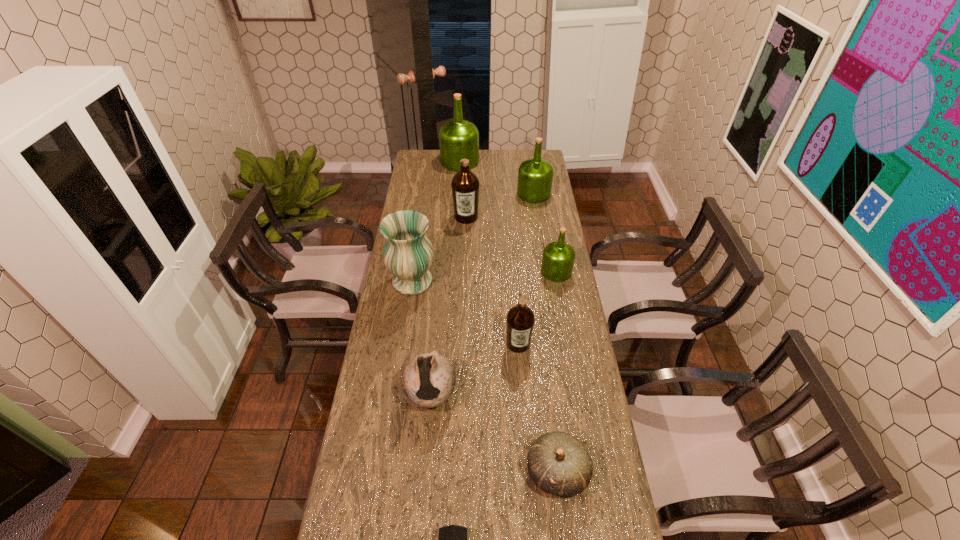
Identify the location of vacant space at the far left corner of the desktop. (423, 154).

Locate an element on the screen. free space that is in between the eighth tallest object and the fourth nearest olive oil is located at coordinates (545, 333).

Identify the location of free space between the vase and the third farthest olive oil. (440, 249).

Where is `unoccupied area between the green vase and the eighth tallest object`? unoccupied area between the green vase and the eighth tallest object is located at coordinates (485, 376).

Identify which object is the seventh nearest to the second nearest object. Please provide its 2D coordinates. Your answer should be formatted as a tuple, i.e. [(x, y)], where the tuple contains the x and y coordinates of a point satisfying the conditions above.

[(535, 176)]

In order to click on object that is the fourth closest to the second farthest green olive oil in this screenshot , I will do `click(408, 254)`.

This screenshot has height=540, width=960. I want to click on the fourth closest olive oil to the third nearest object, so click(x=535, y=176).

Identify which olive oil is the closest to the fourth nearest olive oil. Please provide its 2D coordinates. Your answer should be formatted as a tuple, i.e. [(x, y)], where the tuple contains the x and y coordinates of a point satisfying the conditions above.

[(465, 184)]

Image resolution: width=960 pixels, height=540 pixels. Identify the location of green olive oil that is the second closest one to the second farthest olive oil. (558, 258).

Find the location of a particular element. The width and height of the screenshot is (960, 540). green olive oil that stands as the closest to the dumbbell is located at coordinates (558, 258).